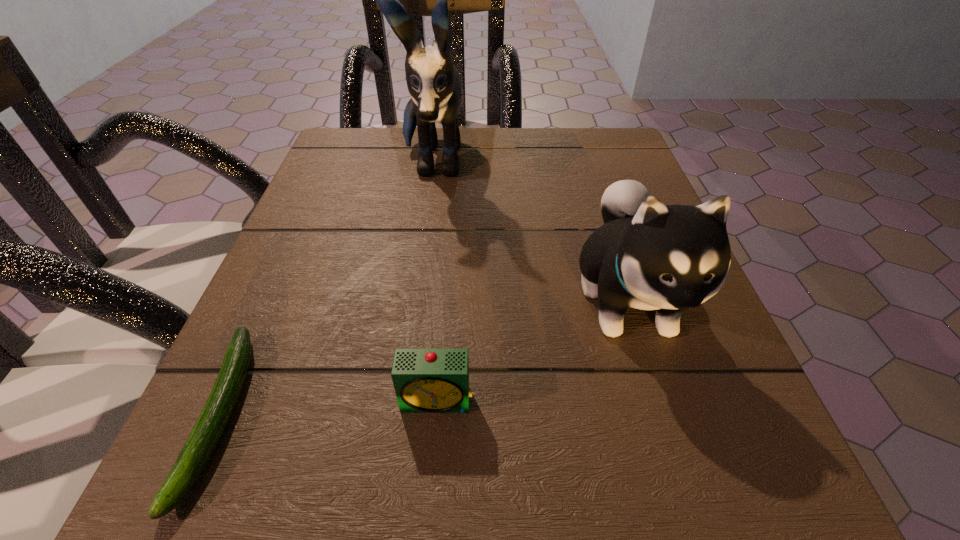
You are a GUI agent. You are given a task and a screenshot of the screen. Output one action in this format:
    pyautogui.click(x=<x>, y=<y>)
    Task: Click on the second closest object to the third tallest object
    
    Given the screenshot: What is the action you would take?
    pyautogui.click(x=208, y=429)

Image resolution: width=960 pixels, height=540 pixels. I want to click on object that ranks as the closest to the rightmost object, so click(x=426, y=380).